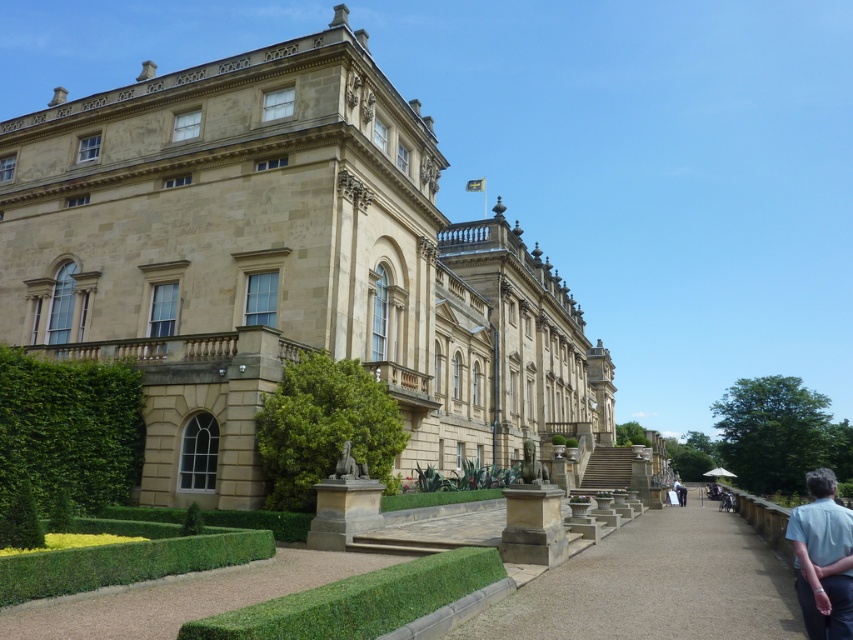
Which is above, green leafy hedge at lower left or light blue shirt at lower right?

Positioned higher is green leafy hedge at lower left.

Is green leafy hedge at lower left above light blue shirt at lower right?

Yes, green leafy hedge at lower left is above light blue shirt at lower right.

Where is `green leafy hedge at lower left`? green leafy hedge at lower left is located at coordinates 68,429.

Consider the image. Does beige stone palace at center appear on the right side of light blue shirt at lower right?

In fact, beige stone palace at center is to the left of light blue shirt at lower right.

Is beige stone palace at center smaller than light blue shirt at lower right?

Incorrect, beige stone palace at center is not smaller in size than light blue shirt at lower right.

Is point (579, 356) positioned after point (833, 628)?

Yes, point (579, 356) is farther from viewer.

I want to click on beige stone palace at center, so click(x=283, y=266).

Who is higher up, brown gravel path at center or green leafy hedge at center?

green leafy hedge at center

Does point (682, 540) lie in front of point (341, 380)?

No, it is not.

Identify the location of brown gravel path at center. (656, 586).